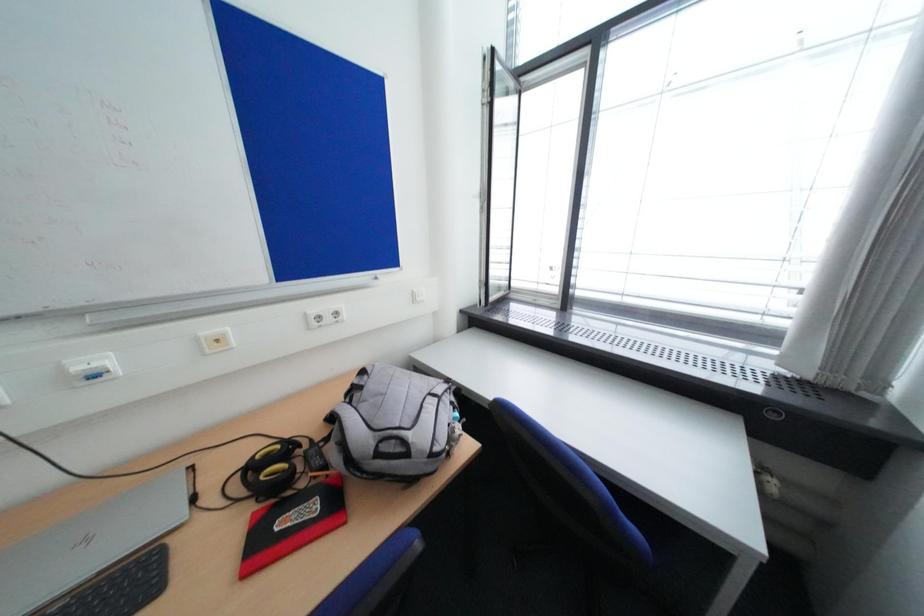
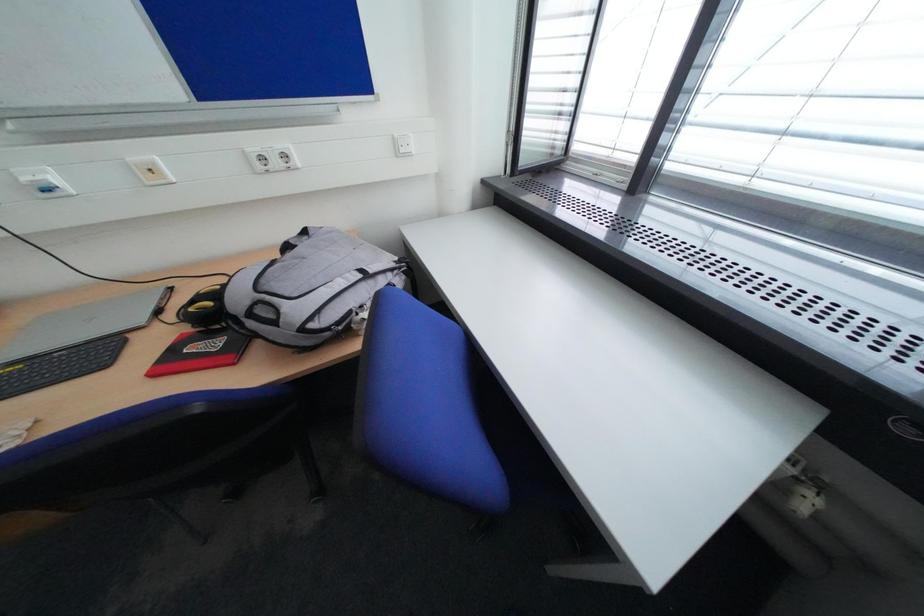
The first image is from the beginning of the video and the second image is from the end. How did the camera likely rotate when shooting the video?

The rotation direction of the camera is left-down.